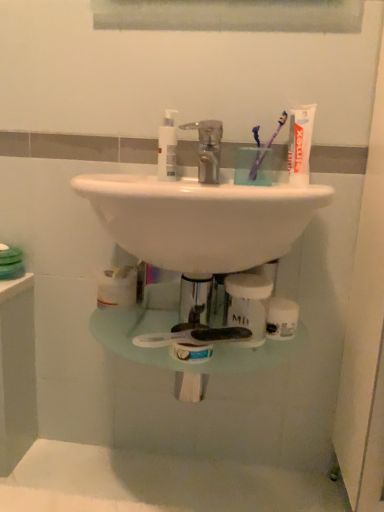
This screenshot has height=512, width=384. What are the coordinates of `free space to the left of clear plastic jar at center, which is the second toiletry in top-to-bottom order` in the screenshot? It's located at (163, 320).